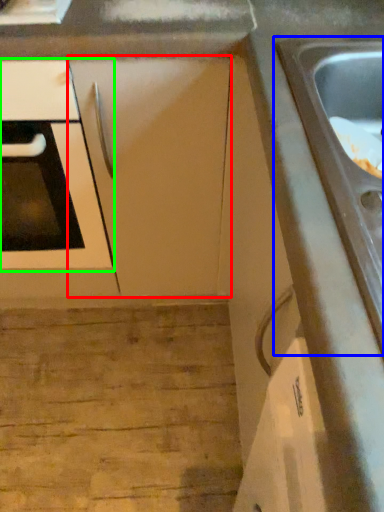
Question: Based on their relative distances, which object is farther from cabinetry (highlighted by a red box)? Choose from sink (highlighted by a blue box) and oven (highlighted by a green box).

Choices:
 (A) sink
 (B) oven

Answer: (A)